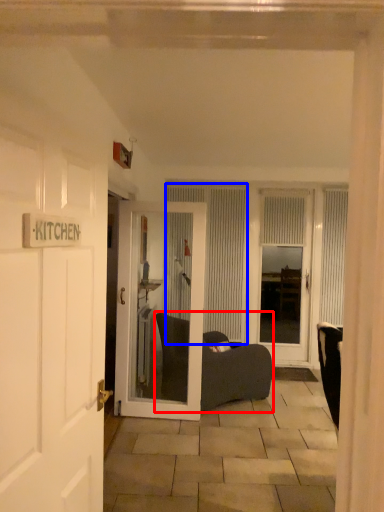
Question: Which object is closer to the camera taking this photo, furniture (highlighted by a red box) or curtain (highlighted by a blue box)?

Choices:
 (A) furniture
 (B) curtain

Answer: (A)